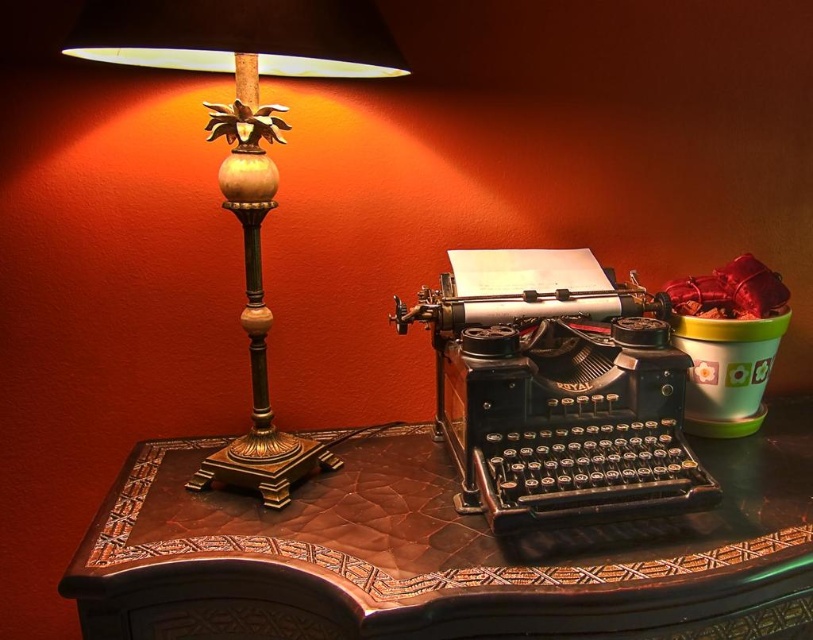
You are standing in the vintage setting described. There is a brown leather table at center. Can you estimate its location in terms of coordinates?

The brown leather table at center is located at coordinates point (x=433, y=550).